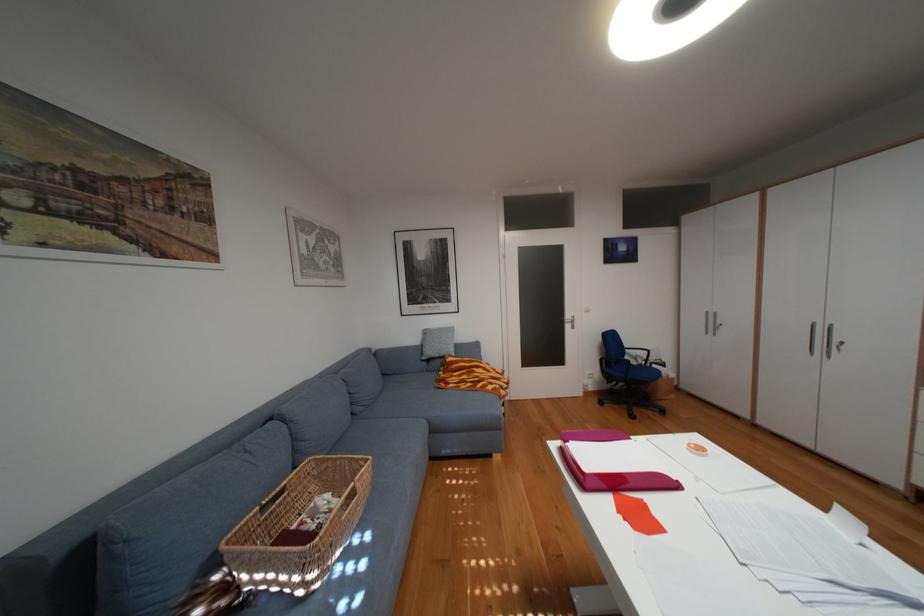
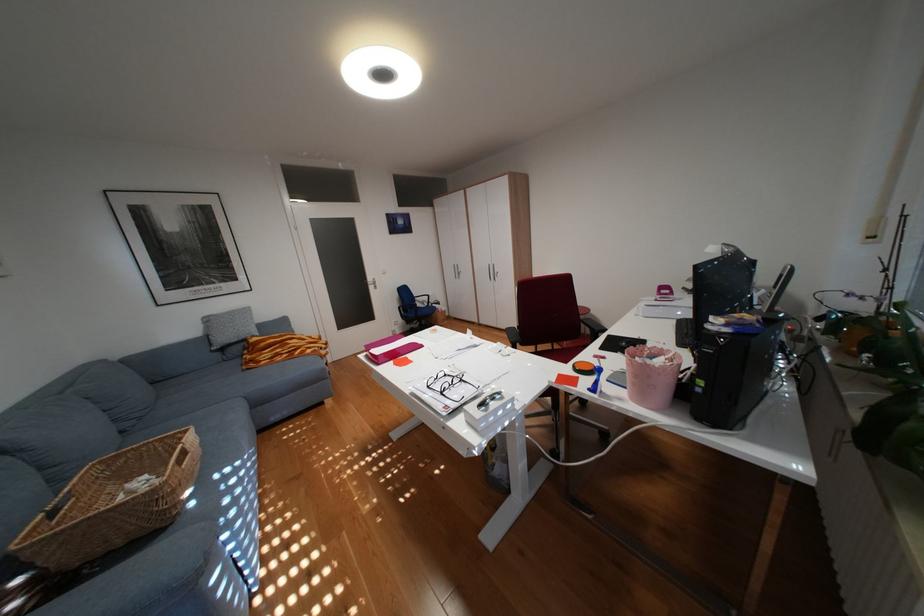
Where in the second image is the point corresponding to pixel 565 445 from the first image?

(373, 355)